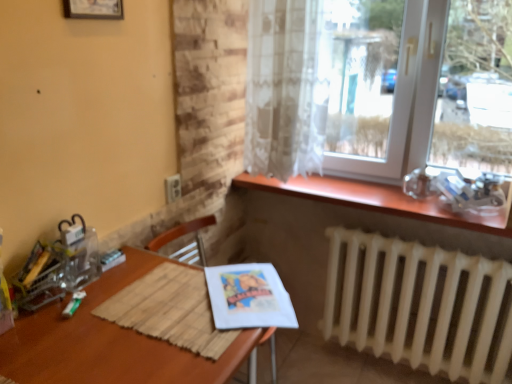
You are a GUI agent. You are given a task and a screenshot of the screen. Output one action in this format:
    pyautogui.click(x=<x>, y=<y>)
    Task: Click on the empty space that is ontop of brown wooden table at center (from a real-world perspective)
    The width and height of the screenshot is (512, 384).
    Given the screenshot: What is the action you would take?
    pyautogui.click(x=137, y=316)